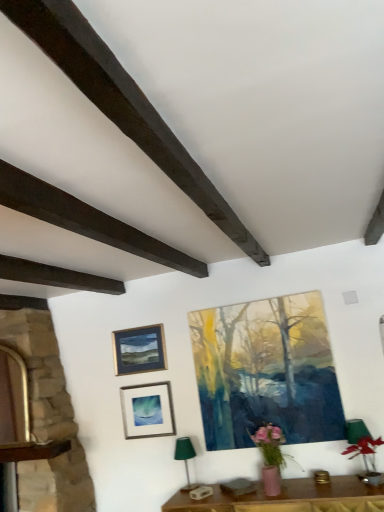
Question: Considering the positions of dark brown wood at upper left, which is the first plank in right-to-left order, and stone fireplace at left in the image, is dark brown wood at upper left, which is the first plank in right-to-left order, wider or thinner than stone fireplace at left?

Choices:
 (A) thin
 (B) wide

Answer: (A)

Question: Looking at the image, does dark brown wood at upper left, which is the first plank in right-to-left order, seem bigger or smaller compared to stone fireplace at left?

Choices:
 (A) big
 (B) small

Answer: (B)

Question: Which object is positioned farthest from the pink matte vase at lower right?

Choices:
 (A) matte glass picture frame at lower center, placed as the 2th picture frame when sorted from left to right
 (B) dark brown wood at upper left, which is the first plank in right-to-left order
 (C) matte acrylic painting at center, the first picture frame from the right
 (D) dark brown wood at upper left, which is the 2th plank in right-to-left order
 (E) stone fireplace at left

Answer: (B)

Question: Which object is the closest to the gold-framed picture at upper left, arranged as the third picture frame when viewed from the right?

Choices:
 (A) dark brown wood at upper left, which is the first plank in left-to-right order
 (B) green fabric lampshade at lower center
 (C) matte acrylic painting at center, the first picture frame from the right
 (D) dark brown wood at upper left, which is the first plank in right-to-left order
 (E) pink matte vase at lower right

Answer: (B)